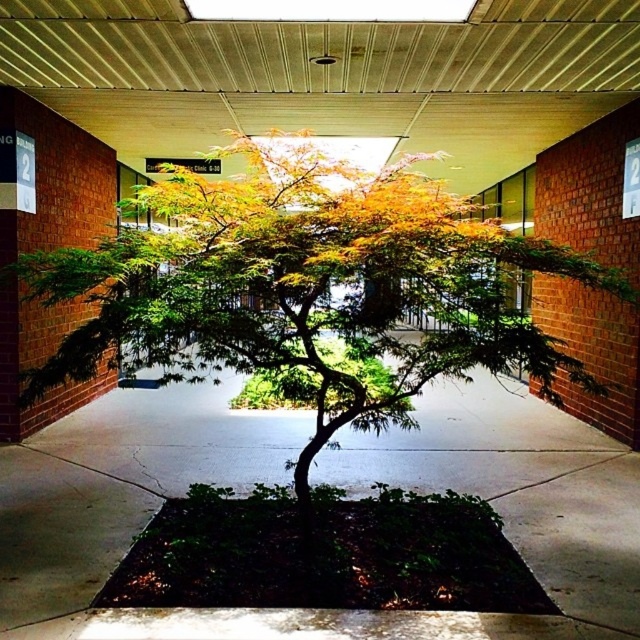
You are a gardener who wants to plant a new tree in the walkway. The green leafy tree at center is currently occupying the central area. Can you fit another tree of the same size as the green concrete pavement at center next to it without overcrowding?

The green leafy tree at center has a larger size compared to green concrete pavement at center. Since the tree is bigger, planting another tree of the same size as the pavement might still leave enough space, but it depends on the actual dimensions. However, based on the size comparison provided, the existing tree is larger, so there might be limited space for another tree of the pavement size.

You are standing on the green concrete pavement at center and want to water the green leafy tree at center. Which direction should you move to reach the tree?

The green leafy tree at center is to the left of the green concrete pavement at center, so you should move to your left to reach the tree.